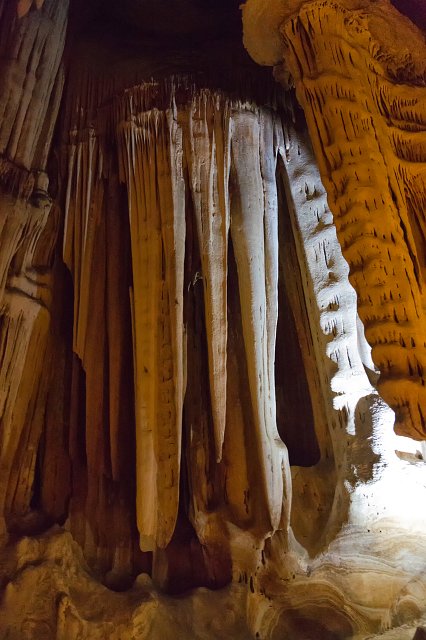
The width and height of the screenshot is (426, 640). I want to click on ceiling, so click(x=313, y=578), click(x=221, y=40).